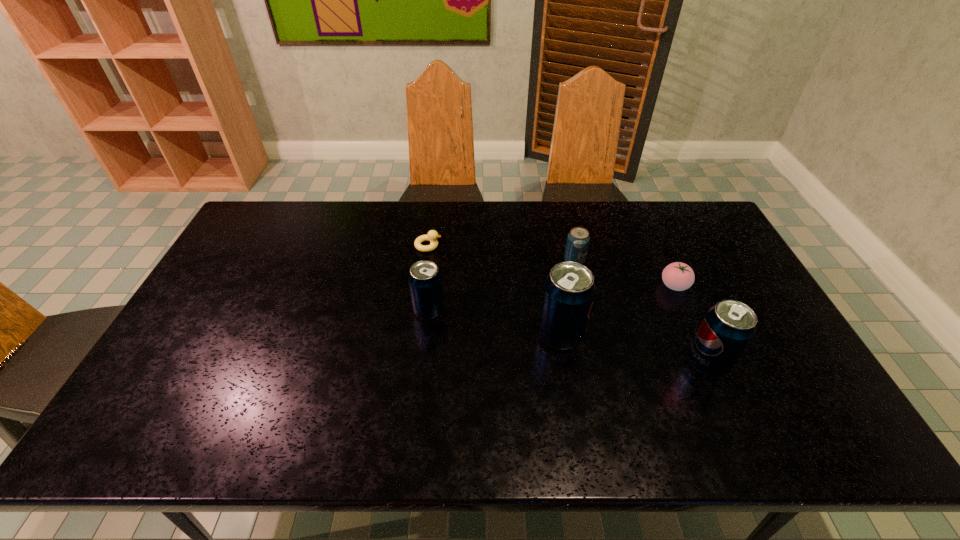
Given the evenly spaced soda cans in the image, where should an extra soda can be added on the left to preserve the spacing? Please point to a vacant space. Please provide its 2D coordinates. Your answer should be formatted as a tuple, i.e. [(x, y)], where the tuple contains the x and y coordinates of a point satisfying the conditions above.

[(310, 288)]